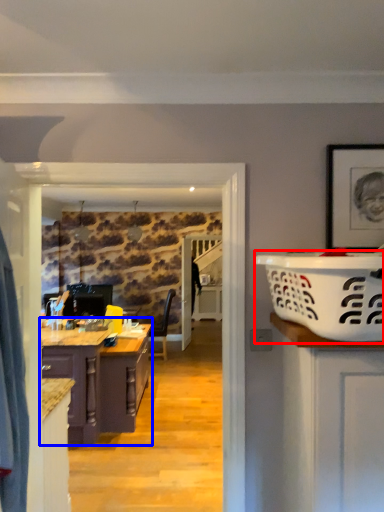
Question: Which of the following is the farthest to the observer, basket (highlighted by a red box) or cabinetry (highlighted by a blue box)?

Choices:
 (A) basket
 (B) cabinetry

Answer: (B)